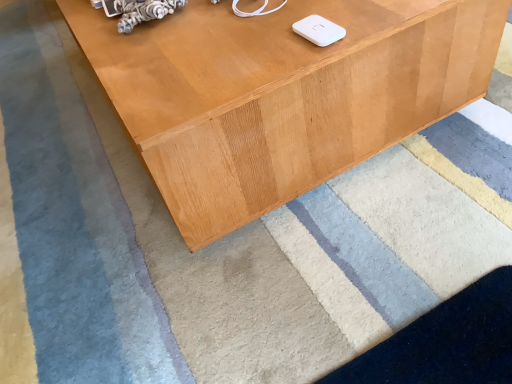
Where is `vacant position to the left of white matte ipod at upper center`? This screenshot has height=384, width=512. vacant position to the left of white matte ipod at upper center is located at coordinates (231, 56).